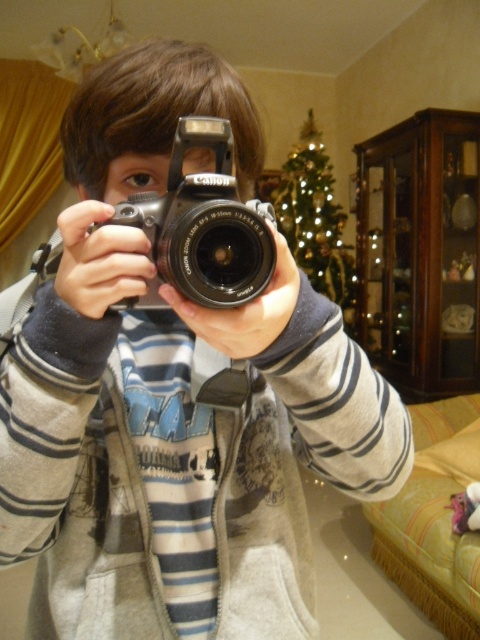
Who is shorter, black plastic camera at center or green textured christmas tree at upper center?

black plastic camera at center

Consider the image. Does black plastic camera at center appear over green textured christmas tree at upper center?

Actually, black plastic camera at center is below green textured christmas tree at upper center.

Which is in front, point (272, 272) or point (331, 180)?

Point (272, 272) is in front.

This screenshot has width=480, height=640. I want to click on black plastic camera at center, so click(202, 227).